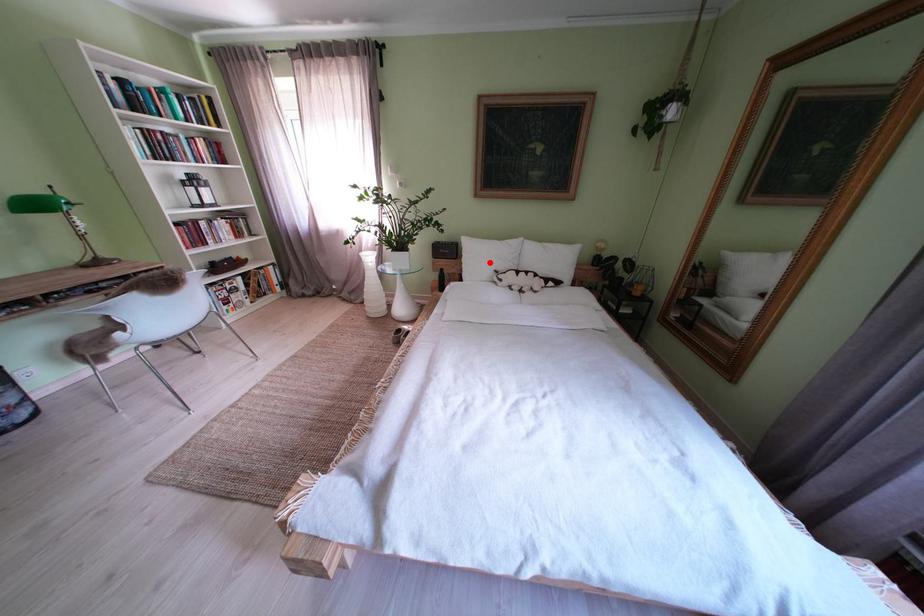
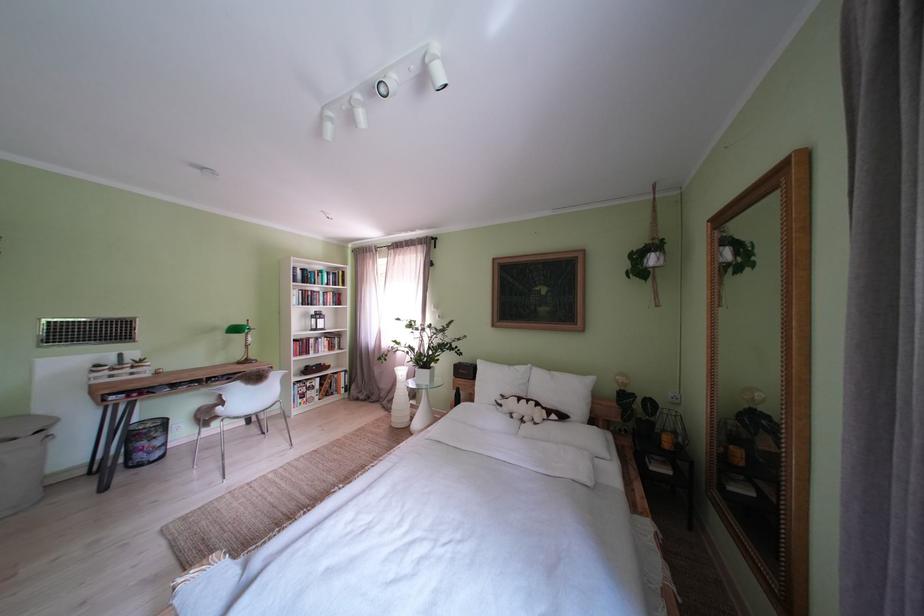
Where in the second image is the point corresponding to the highlighted location from the first image?

(500, 386)